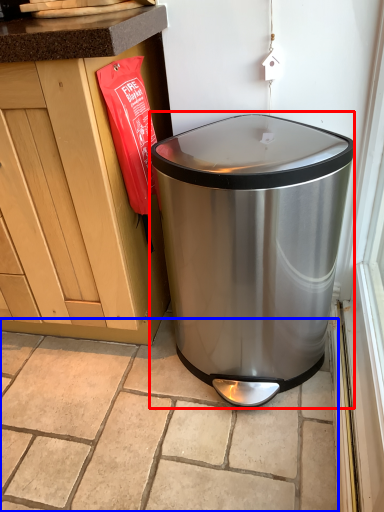
Question: Which object appears closest to the camera in this image, waste container (highlighted by a red box) or tile (highlighted by a blue box)?

Choices:
 (A) waste container
 (B) tile

Answer: (A)